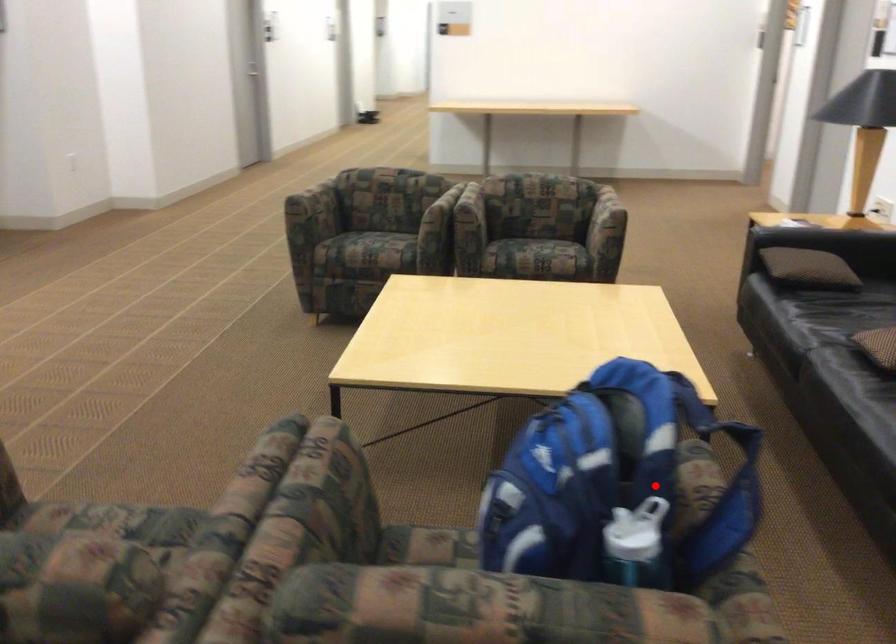
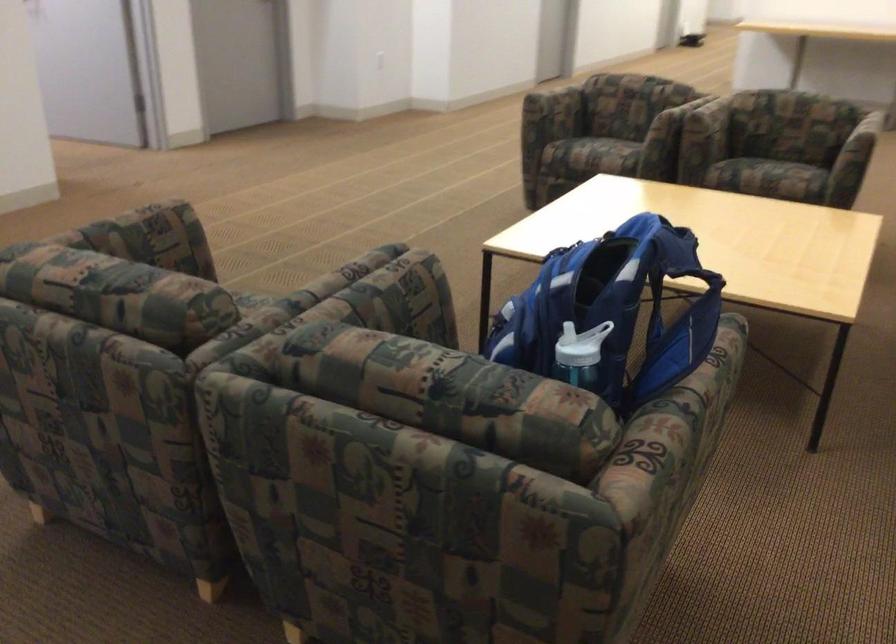
Question: A red point is marked in image1. In image2, is the corresponding 3D point closer to the camera or farther? Reply with the corresponding letter.

Choices:
 (A) The corresponding 3D point is closer.
 (B) The corresponding 3D point is farther.

Answer: (B)